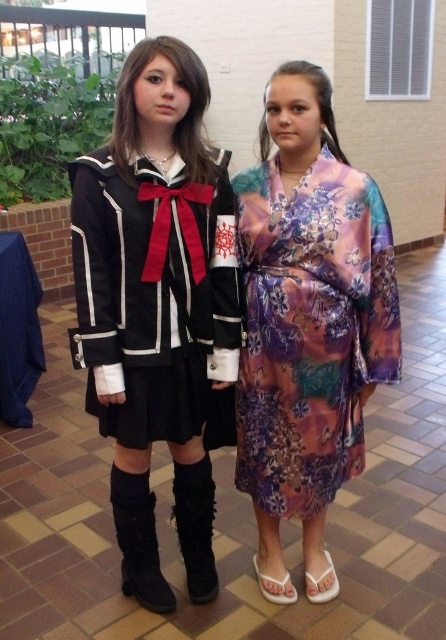
Who is positioned more to the left, floral silk kimono at center or black suede boot at lower center?

Positioned to the left is black suede boot at lower center.

Does floral silk kimono at center come in front of black suede boot at lower center?

Yes, floral silk kimono at center is in front of black suede boot at lower center.

Does point (316, 364) come in front of point (185, 506)?

Yes, point (316, 364) is in front of point (185, 506).

Where is `floral silk kimono at center`? The image size is (446, 640). floral silk kimono at center is located at coordinates (308, 323).

Which is below, black suede boot at lower left or black suede boot at lower center?

black suede boot at lower left

Which is more to the left, black suede boot at lower left or black suede boot at lower center?

black suede boot at lower left is more to the left.

The image size is (446, 640). In order to click on black suede boot at lower left in this screenshot , I will do `click(139, 540)`.

Is the position of satin black dress at center more distant than that of black suede boot at lower center?

No, it is not.

Where is `satin black dress at center`? This screenshot has height=640, width=446. satin black dress at center is located at coordinates (156, 307).